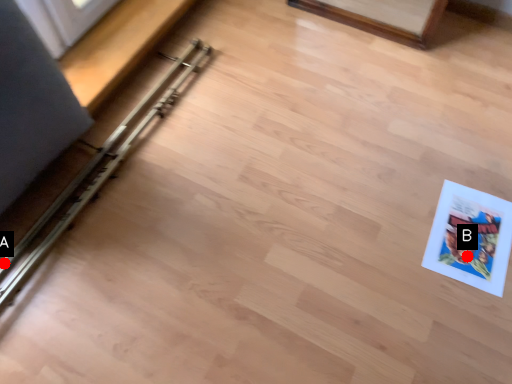
Question: Two points are circled on the image, labeled by A and B beside each circle. Which point appears closest to the camera in this image?

Choices:
 (A) A is closer
 (B) B is closer

Answer: (A)